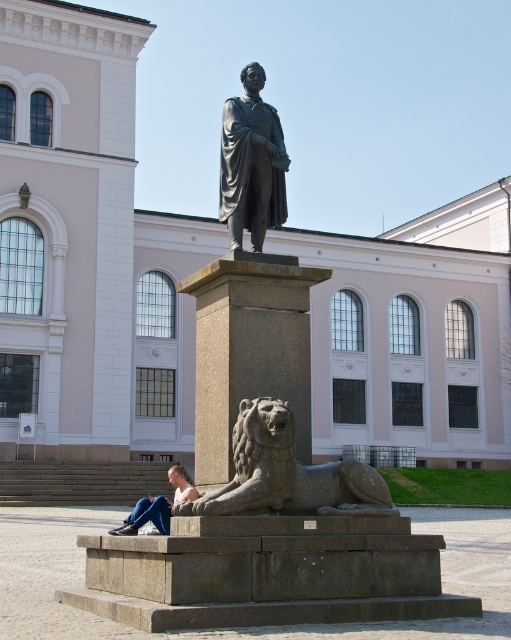
Looking at this image, you are standing in front of the statue and want to determine the relative positions of two points marked on the pedestal. Which point is closer to you, point [257,124] or point [151,506]?

Point [257,124] is closer to the viewer than point [151,506].

You are standing in front of the classical building and want to find the granite lion at lower center. According to the coordinates, where should you look?

The granite lion at lower center is located at the 2D coordinates point (287, 474), so you should look towards the lower center area of the image.